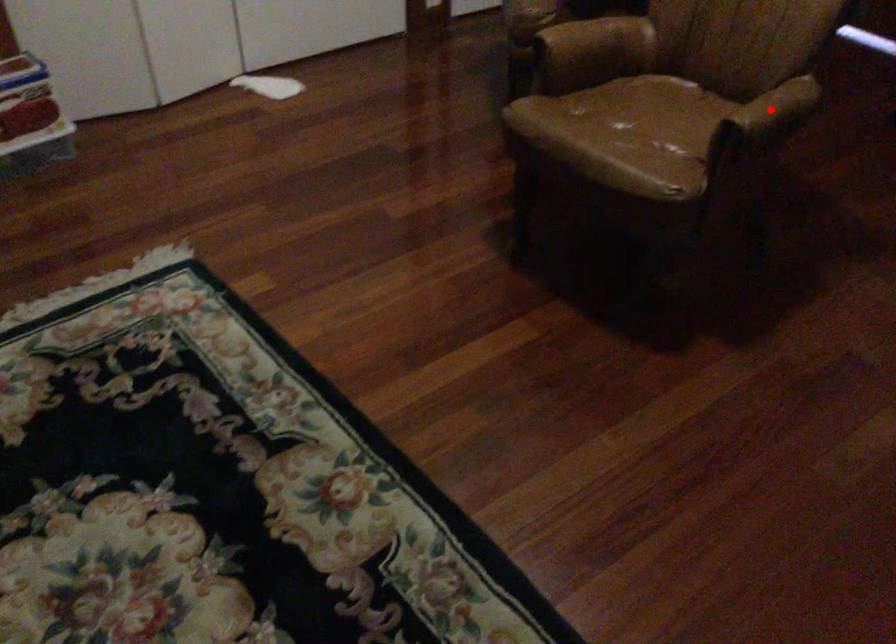
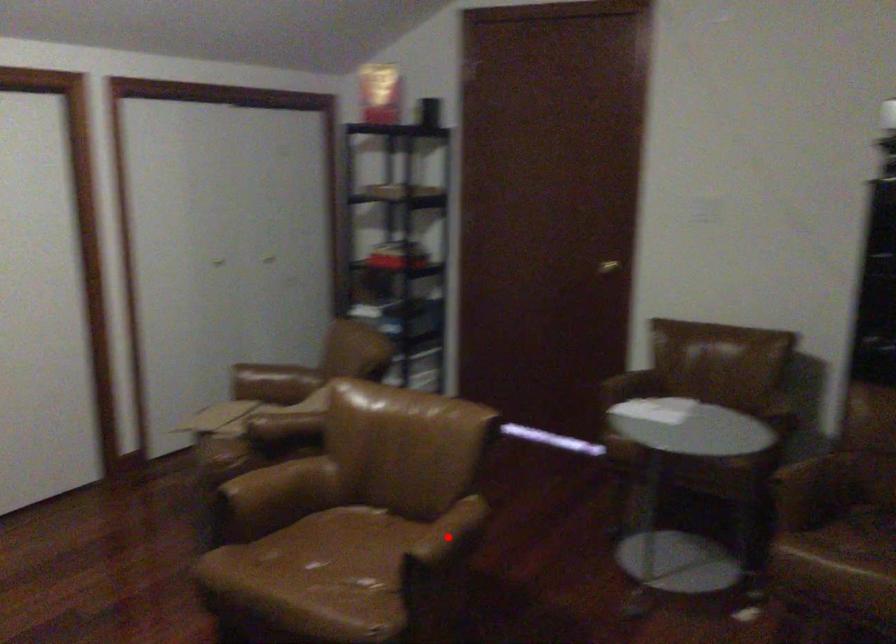
I am providing you with two images of the same scene from different viewpoints. A red point is marked on the first image and another point is marked on the second image. Does the point marked in image1 correspond to the same location as the one in image2?

Yes